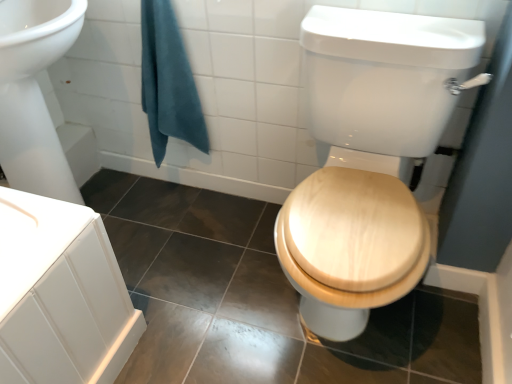
Question: Considering their positions, is wooden toilet seat at center located in front of or behind teal cotton towel at upper left?

Choices:
 (A) behind
 (B) front

Answer: (B)

Question: Considering the positions of wooden toilet seat at center and teal cotton towel at upper left in the image, is wooden toilet seat at center taller or shorter than teal cotton towel at upper left?

Choices:
 (A) short
 (B) tall

Answer: (B)

Question: Is wooden toilet seat at center bigger or smaller than teal cotton towel at upper left?

Choices:
 (A) big
 (B) small

Answer: (A)

Question: Considering the positions of point (178, 72) and point (420, 79), is point (178, 72) closer or farther from the camera than point (420, 79)?

Choices:
 (A) closer
 (B) farther

Answer: (B)

Question: Based on their positions, is teal cotton towel at upper left located to the left or right of wooden toilet seat at center?

Choices:
 (A) left
 (B) right

Answer: (A)

Question: Is teal cotton towel at upper left spatially inside wooden toilet seat at center, or outside of it?

Choices:
 (A) inside
 (B) outside

Answer: (B)

Question: Considering their positions, is teal cotton towel at upper left located in front of or behind wooden toilet seat at center?

Choices:
 (A) front
 (B) behind

Answer: (B)